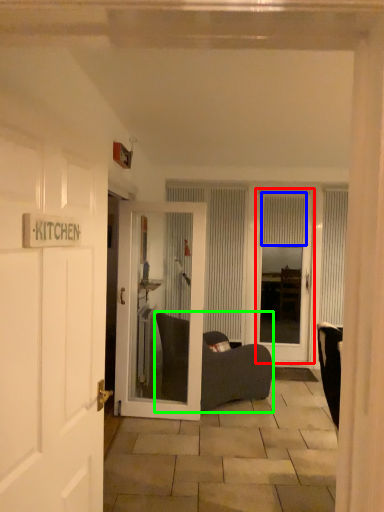
Question: Considering the real-world distances, which object is closest to door (highlighted by a red box)? curtain (highlighted by a blue box) or furniture (highlighted by a green box).

Choices:
 (A) curtain
 (B) furniture

Answer: (A)